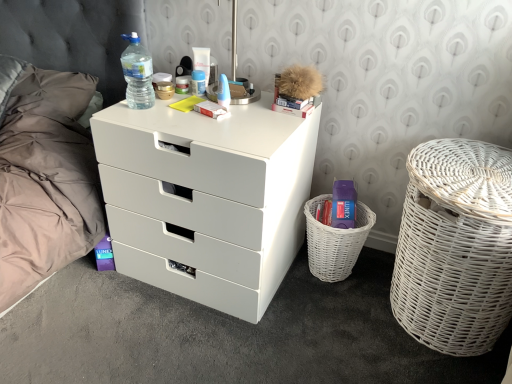
Question: From the image's perspective, is white plastic tube at upper center, the second toiletry from the right, located above or below blue plastic toothbrush at upper center, the fourth toiletry when ordered from left to right?

Choices:
 (A) above
 (B) below

Answer: (A)

Question: From a real-world perspective, is white plastic tube at upper center, the 3th toiletry positioned from the left, positioned above or below blue plastic toothbrush at upper center, the 1th toiletry when ordered from right to left?

Choices:
 (A) above
 (B) below

Answer: (A)

Question: Estimate the real-world distances between objects in this image. Which object is farther from the white plastic tube at upper center, the second toiletry from the right?

Choices:
 (A) white wicker basket at right
 (B) translucent plastic bottle at upper left
 (C) dark gray fabric bed at left
 (D) blue plastic toothbrush at upper center, the fourth toiletry when ordered from left to right
 (E) blue plastic container at center, which appears as the 3th toiletry when viewed from the right

Answer: (A)

Question: Based on their relative distances, which object is nearer to the blue plastic toothbrush at upper center, the fourth toiletry when ordered from left to right?

Choices:
 (A) matte plastic container at center, which appears as the 4th toiletry when viewed from the right
 (B) translucent plastic bottle at upper left
 (C) white wicker basket at right
 (D) white wicker basket at lower right
 (E) blue plastic container at center, arranged as the 2th toiletry when viewed from the left

Answer: (E)